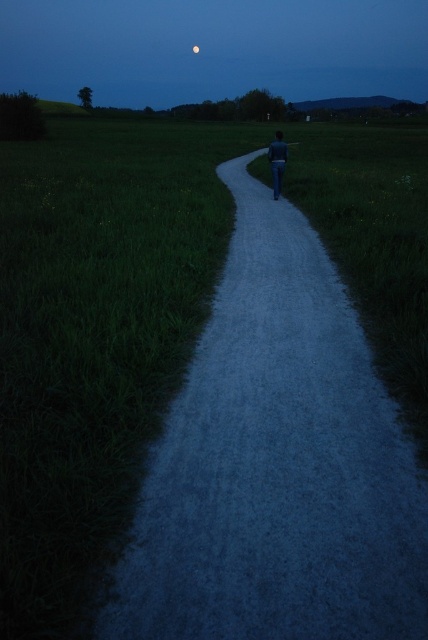
Who is lower down, full moon at upper center or blue denim jeans at center?

blue denim jeans at center is lower down.

This screenshot has width=428, height=640. Identify the location of full moon at upper center. (213, 49).

Image resolution: width=428 pixels, height=640 pixels. Identify the location of full moon at upper center. point(213,49).

In the scene shown: Which of these two, full moon at upper center or silvery reflective moon at upper center, stands taller?

With more height is full moon at upper center.

Does full moon at upper center have a greater width compared to silvery reflective moon at upper center?

Indeed, full moon at upper center has a greater width compared to silvery reflective moon at upper center.

Who is more forward, (413, 8) or (196, 45)?

Positioned in front is point (196, 45).

Locate an element on the screen. This screenshot has height=640, width=428. full moon at upper center is located at coordinates (213, 49).

Does point (281, 186) come in front of point (193, 49)?

Yes, it is.

Measure the distance between blue denim jeans at center and camera.

They are 14.12 meters apart.

This screenshot has height=640, width=428. I want to click on blue denim jeans at center, so pos(278,161).